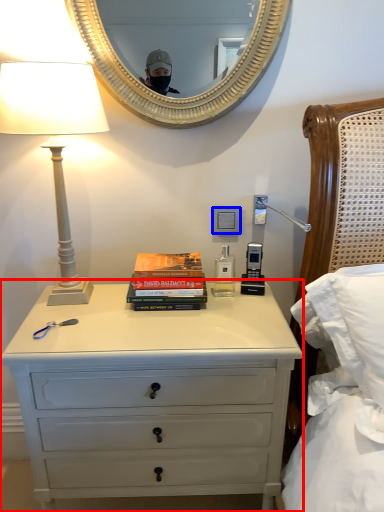
Question: Which of the following is the farthest to the observer, chest of drawers (highlighted by a red box) or power outlet (highlighted by a blue box)?

Choices:
 (A) chest of drawers
 (B) power outlet

Answer: (B)